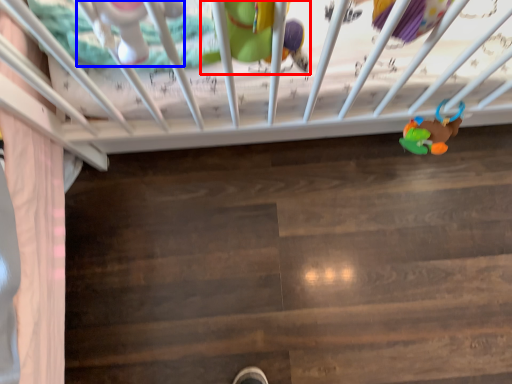
Question: Which of the following is the farthest to the observer, toy (highlighted by a red box) or toy (highlighted by a blue box)?

Choices:
 (A) toy
 (B) toy

Answer: (A)